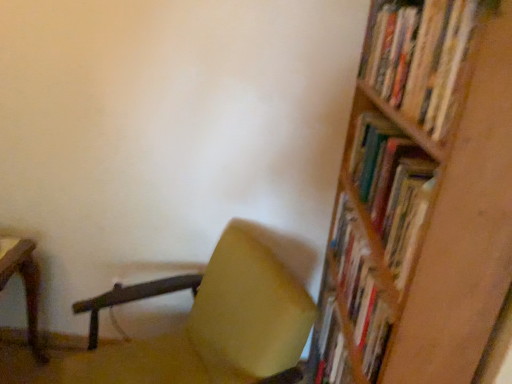
Image resolution: width=512 pixels, height=384 pixels. What do you see at coordinates (239, 307) in the screenshot? I see `matte yellow chair at center` at bounding box center [239, 307].

Measure the distance between wooden bookshelf at upper right and camera.

wooden bookshelf at upper right is 22.80 inches away from camera.

Identify the location of wooden bookshelf at right. (421, 199).

Looking at this image, does wooden bookshelf at upper right lie in front of wooden bookshelf at right?

No, wooden bookshelf at upper right is further to the viewer.

How many degrees apart are the facing directions of wooden bookshelf at upper right and wooden bookshelf at right?

The angular difference between wooden bookshelf at upper right and wooden bookshelf at right is 0.76 degrees.

From a real-world perspective, which is physically above, wooden bookshelf at upper right or wooden bookshelf at right?

In real-world perspective, wooden bookshelf at upper right is above.

Is wooden bookshelf at upper right positioned far away from matte yellow chair at center?

No, wooden bookshelf at upper right is not far away from matte yellow chair at center.

Which of these two, wooden bookshelf at upper right or matte yellow chair at center, is wider?

matte yellow chair at center is wider.

From a real-world perspective, is wooden bookshelf at upper right positioned over matte yellow chair at center based on gravity?

Correct, in the physical world, wooden bookshelf at upper right is higher than matte yellow chair at center.

Could matte yellow chair at center be considered to be inside wooden bookshelf at upper right?

Actually, matte yellow chair at center is outside wooden bookshelf at upper right.

In the scene shown: Is wooden bookshelf at right smaller than wooden bookshelf at upper right?

Incorrect, wooden bookshelf at right is not smaller in size than wooden bookshelf at upper right.

Considering the positions of objects wooden bookshelf at right and wooden bookshelf at upper right in the image provided, who is more to the right, wooden bookshelf at right or wooden bookshelf at upper right?

Positioned to the right is wooden bookshelf at upper right.

Is wooden bookshelf at right with wooden bookshelf at upper right?

No, wooden bookshelf at right is not beside wooden bookshelf at upper right.

From a real-world perspective, who is located lower, wooden bookshelf at right or wooden bookshelf at upper right?

From a 3D spatial view, wooden bookshelf at right is below.

Is wooden bookshelf at right located outside matte yellow chair at center?

Yes, wooden bookshelf at right is not within matte yellow chair at center.

Can you confirm if wooden bookshelf at right is bigger than matte yellow chair at center?

Yes, wooden bookshelf at right is bigger than matte yellow chair at center.

From a real-world perspective, which is physically below, wooden bookshelf at right or matte yellow chair at center?

In real-world perspective, matte yellow chair at center is lower.

Considering the relative sizes of wooden bookshelf at right and matte yellow chair at center in the image provided, is wooden bookshelf at right taller than matte yellow chair at center?

Yes.

Considering the relative positions of matte yellow chair at center and wooden bookshelf at right in the image provided, is matte yellow chair at center to the left of wooden bookshelf at right from the viewer's perspective?

Yes.

Can you see matte yellow chair at center touching wooden bookshelf at right?

matte yellow chair at center is not next to wooden bookshelf at right, and they're not touching.

Looking at the image, does matte yellow chair at center seem bigger or smaller compared to wooden bookshelf at right?

matte yellow chair at center is smaller than wooden bookshelf at right.

Is matte yellow chair at center thinner than wooden bookshelf at right?

Incorrect, the width of matte yellow chair at center is not less than that of wooden bookshelf at right.

From a real-world perspective, is matte yellow chair at center positioned over wooden bookshelf at upper right based on gravity?

No.

Which point is more distant from viewer, (245, 230) or (441, 80)?

The point (245, 230) is more distant.

In the scene shown: Would you consider matte yellow chair at center to be distant from wooden bookshelf at upper right?

No, matte yellow chair at center is in close proximity to wooden bookshelf at upper right.

In the scene shown: Who is taller, matte yellow chair at center or wooden bookshelf at upper right?

With more height is matte yellow chair at center.

Find the location of a particular element. This screenshot has height=384, width=512. shelf below the wooden bookshelf at upper right (from the image's perspective) is located at coordinates (421, 199).

Locate an element on the screen. This screenshot has height=384, width=512. chair located on the left of wooden bookshelf at upper right is located at coordinates (239, 307).

Looking at the image, which one is located further to wooden bookshelf at upper right, wooden bookshelf at right or matte yellow chair at center?

Among the two, matte yellow chair at center is located further to wooden bookshelf at upper right.

Looking at the image, which one is located further to wooden bookshelf at right, wooden bookshelf at upper right or matte yellow chair at center?

matte yellow chair at center is further to wooden bookshelf at right.

Consider the image. Based on their spatial positions, is matte yellow chair at center or wooden bookshelf at right closer to wooden bookshelf at upper right?

Based on the image, wooden bookshelf at right appears to be nearer to wooden bookshelf at upper right.

Looking at the image, which one is located further to matte yellow chair at center, wooden bookshelf at upper right or wooden bookshelf at right?

Among the two, wooden bookshelf at upper right is located further to matte yellow chair at center.

Considering their positions, is matte yellow chair at center positioned closer to wooden bookshelf at right than wooden bookshelf at upper right?

wooden bookshelf at upper right is closer to wooden bookshelf at right.

Estimate the real-world distances between objects in this image. Which object is closer to matte yellow chair at center, wooden bookshelf at right or wooden bookshelf at upper right?

wooden bookshelf at right is closer to matte yellow chair at center.

Find the location of a particular element. shelf between wooden bookshelf at upper right and matte yellow chair at center in the vertical direction is located at coordinates (421, 199).